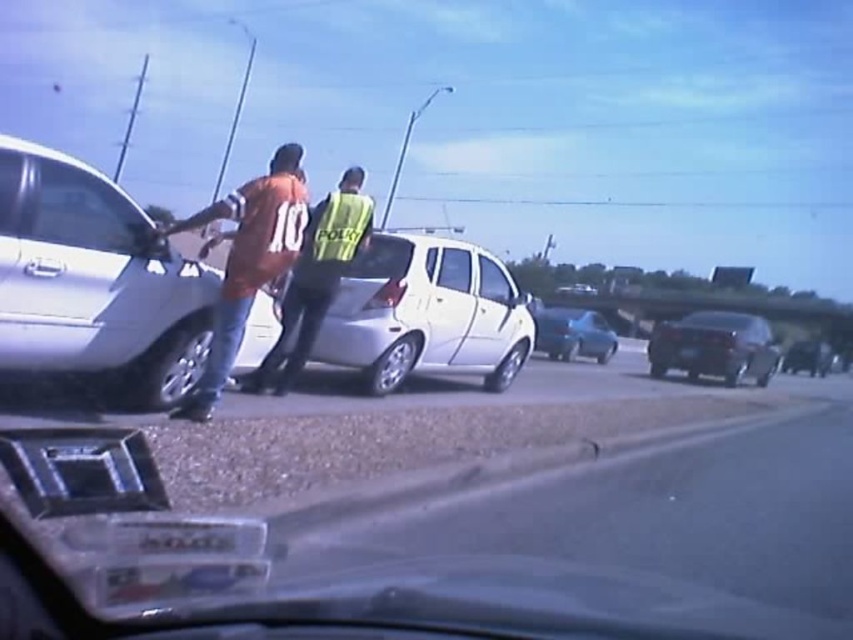
Question: Which of the following is the farthest from the observer?

Choices:
 (A) silver metallic sedan at left
 (B) black glossy sedan at center
 (C) shiny black sedan at center
 (D) metallic silver sedan at center

Answer: (C)

Question: Can you confirm if silver metallic sedan at left is positioned below orange jersey at left?

Choices:
 (A) yes
 (B) no

Answer: (A)

Question: Which point is farther to the camera?

Choices:
 (A) metallic silver sedan at center
 (B) silver metallic sedan at left

Answer: (A)

Question: Is orange jersey at left bigger than black glossy sedan at center?

Choices:
 (A) no
 (B) yes

Answer: (A)

Question: Which of the following is the closest to the observer?

Choices:
 (A) (32, 332)
 (B) (535, 349)
 (C) (578, 284)

Answer: (A)

Question: Can you confirm if shiny black sedan at center is wider than white matte sedan at center?

Choices:
 (A) yes
 (B) no

Answer: (A)